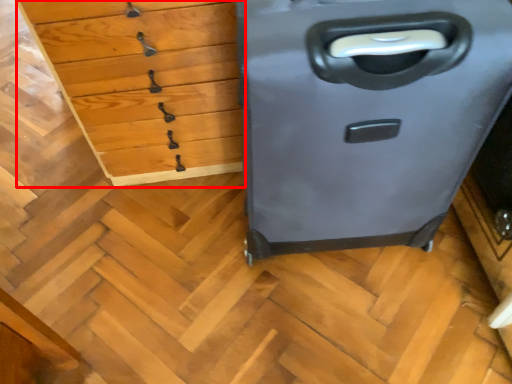
Question: Where is chest of drawers (annotated by the red box) located in relation to file cabinet in the image?

Choices:
 (A) left
 (B) right

Answer: (A)